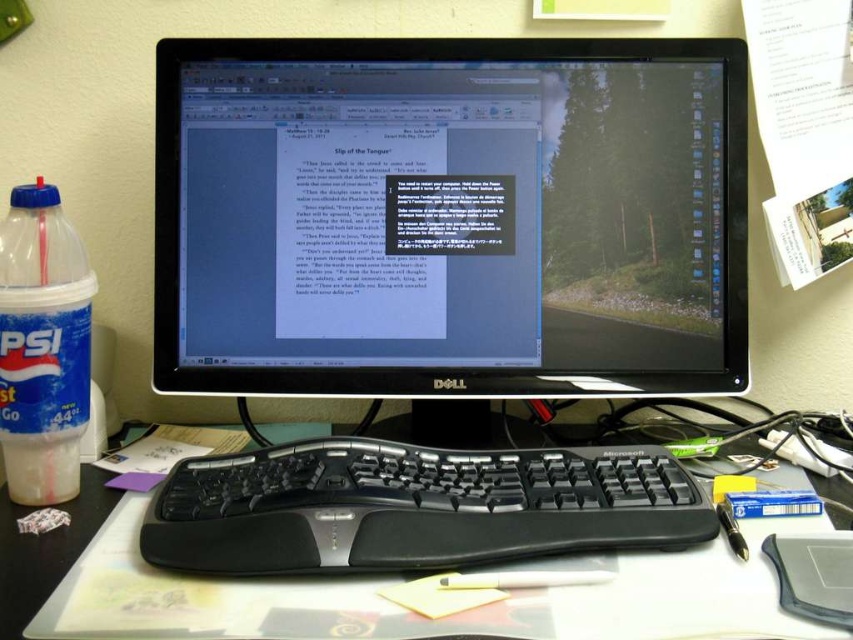
You need to place both the translucent plastic bottle at left and the black plastic mouse at lower right into a storage box. The box can only fit items up to the size of the mouse. Will both items fit?

The translucent plastic bottle at left is larger in size than the black plastic mouse at lower right, so it will not fit into the storage box designed for items up to the mouse size. Only the mouse can be placed inside.

You are organizing items on a desk. You need to place a new item between the black plastic keyboard at center and the translucent plastic bottle at left. Can you do this without moving either existing item?

The black plastic keyboard at center is closer to the viewer than the translucent plastic bottle at left, so there is space between them to place a new item without moving either existing item.

You are organizing your desk and want to place a new item between the black glossy monitor at center and the black plastic mouse at lower right. Is there enough space between them to fit an item that is 10 centimeters wide?

The black glossy monitor at center is to the left of the black plastic mouse at lower right, so there is space between them. Since the item is only 10 centimeters wide, it should fit as long as the distance between the two objects is at least 10 centimeters. However, the exact distance isn